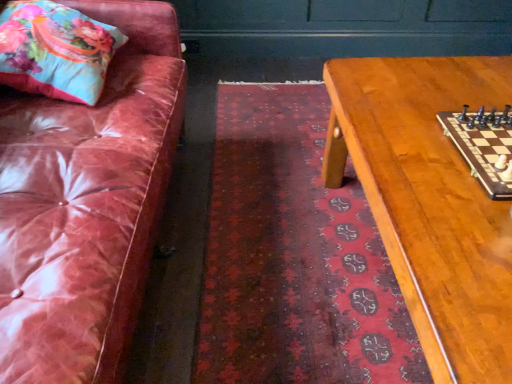
This screenshot has width=512, height=384. What do you see at coordinates (294, 256) in the screenshot?
I see `dark red textured rug at center` at bounding box center [294, 256].

What are the coordinates of `floral fabric pillow at upper left` in the screenshot? It's located at (55, 51).

Where is `wooden chessboard at right`? Image resolution: width=512 pixels, height=384 pixels. wooden chessboard at right is located at coordinates (484, 146).

Identify the location of dark red textured rug at center. (294, 256).

Considering the sizes of wooden chessboard at right and floral fabric pillow at upper left in the image, is wooden chessboard at right taller or shorter than floral fabric pillow at upper left?

Considering their sizes, wooden chessboard at right has less height than floral fabric pillow at upper left.

Can you see wooden chessboard at right touching floral fabric pillow at upper left?

No, wooden chessboard at right is not next to floral fabric pillow at upper left.

Where is `board game below the floral fabric pillow at upper left (from the image's perspective)`? board game below the floral fabric pillow at upper left (from the image's perspective) is located at coordinates (484, 146).

Would you say wooden chessboard at right is outside floral fabric pillow at upper left?

That's correct, wooden chessboard at right is outside of floral fabric pillow at upper left.

Considering the sizes of wooden chessboard at right and dark red textured rug at center in the image, is wooden chessboard at right taller or shorter than dark red textured rug at center?

Clearly, wooden chessboard at right is shorter compared to dark red textured rug at center.

I want to click on mat located underneath the wooden chessboard at right (from a real-world perspective), so click(x=294, y=256).

Are wooden chessboard at right and dark red textured rug at center far apart?

They are positioned close to each other.

From a real-world perspective, relative to dark red textured rug at center, is wooden chessboard at right vertically above or below?

In terms of real-world spatial position, wooden chessboard at right is above dark red textured rug at center.

Based on the photo, between wooden chessboard at center and dark red textured rug at center, which one has more height?

wooden chessboard at center is taller.

Is wooden chessboard at center wider or thinner than dark red textured rug at center?

Considering their sizes, wooden chessboard at center looks broader than dark red textured rug at center.

Looking at the image, does wooden chessboard at center seem bigger or smaller compared to dark red textured rug at center?

In the image, wooden chessboard at center appears to be larger than dark red textured rug at center.

From the picture: Is the position of wooden chessboard at center less distant than that of dark red textured rug at center?

Yes, it is.

Is dark red textured rug at center positioned beyond the bounds of floral fabric pillow at upper left?

That's correct, dark red textured rug at center is outside of floral fabric pillow at upper left.

From the image's perspective, is dark red textured rug at center located above or below floral fabric pillow at upper left?

Based on their image positions, dark red textured rug at center is located beneath floral fabric pillow at upper left.

Considering the relative sizes of dark red textured rug at center and floral fabric pillow at upper left in the image provided, is dark red textured rug at center shorter than floral fabric pillow at upper left?

Indeed, dark red textured rug at center has a lesser height compared to floral fabric pillow at upper left.

How many degrees apart are the facing directions of dark red textured rug at center and floral fabric pillow at upper left?

The angle between the facing direction of dark red textured rug at center and the facing direction of floral fabric pillow at upper left is 0.296 degrees.

Locate an element on the screen. The height and width of the screenshot is (384, 512). throw pillow that appears above the dark red textured rug at center (from a real-world perspective) is located at coordinates (55, 51).

Which is in front, floral fabric pillow at upper left or dark red textured rug at center?

dark red textured rug at center is more forward.

Does point (55, 41) come closer to viewer compared to point (208, 379)?

No, (55, 41) is behind (208, 379).

Which is in front, point (331, 376) or point (488, 134)?

The point (488, 134) is more forward.

From the image's perspective, which one is positioned lower, dark red textured rug at center or wooden chessboard at right?

dark red textured rug at center appears lower in the image.

Are dark red textured rug at center and wooden chessboard at right making contact?

No, dark red textured rug at center is not touching wooden chessboard at right.

From a real-world perspective, which is physically below, dark red textured rug at center or wooden chessboard at right?

dark red textured rug at center.

The height and width of the screenshot is (384, 512). Find the location of `throw pillow positioned vertically above the wooden chessboard at right (from a real-world perspective)`. throw pillow positioned vertically above the wooden chessboard at right (from a real-world perspective) is located at coordinates click(55, 51).

Considering the relative sizes of floral fabric pillow at upper left and wooden chessboard at right in the image provided, is floral fabric pillow at upper left smaller than wooden chessboard at right?

Incorrect, floral fabric pillow at upper left is not smaller in size than wooden chessboard at right.

From the image's perspective, relative to wooden chessboard at right, is floral fabric pillow at upper left above or below?

Clearly, from the image's perspective, floral fabric pillow at upper left is above wooden chessboard at right.

How many degrees apart are the facing directions of floral fabric pillow at upper left and wooden chessboard at right?

There is a 0.000992-degree angle between the facing directions of floral fabric pillow at upper left and wooden chessboard at right.

Where is `throw pillow that appears on the left of wooden chessboard at right`? throw pillow that appears on the left of wooden chessboard at right is located at coordinates (55, 51).

Identify the location of board game in front of the dark red textured rug at center. The width and height of the screenshot is (512, 384). (484, 146).

Considering their positions, is floral fabric pillow at upper left positioned closer to wooden chessboard at center than dark red textured rug at center?

The object closer to wooden chessboard at center is dark red textured rug at center.

Which object lies further to the anchor point wooden chessboard at right, floral fabric pillow at upper left or wooden chessboard at center?

floral fabric pillow at upper left.

Estimate the real-world distances between objects in this image. Which object is closer to floral fabric pillow at upper left, wooden chessboard at center or wooden chessboard at right?

wooden chessboard at center is closer to floral fabric pillow at upper left.

Considering their positions, is wooden chessboard at right positioned further to wooden chessboard at center than dark red textured rug at center?

dark red textured rug at center.

From the image, which object appears to be farther from wooden chessboard at center, dark red textured rug at center or wooden chessboard at right?

Among the two, dark red textured rug at center is located further to wooden chessboard at center.

Looking at the image, which one is located closer to wooden chessboard at right, wooden chessboard at center or dark red textured rug at center?

Based on the image, wooden chessboard at center appears to be nearer to wooden chessboard at right.

From the picture: Based on their spatial positions, is dark red textured rug at center or wooden chessboard at center closer to wooden chessboard at right?

wooden chessboard at center.

Based on their spatial positions, is wooden chessboard at center or dark red textured rug at center further from floral fabric pillow at upper left?

wooden chessboard at center.

Where is `mat between floral fabric pillow at upper left and wooden chessboard at right in the horizontal direction`? mat between floral fabric pillow at upper left and wooden chessboard at right in the horizontal direction is located at coordinates (294, 256).

Image resolution: width=512 pixels, height=384 pixels. I want to click on table situated between dark red textured rug at center and wooden chessboard at right from left to right, so click(430, 201).

Find the location of a particular element. The width and height of the screenshot is (512, 384). mat between floral fabric pillow at upper left and wooden chessboard at center in the horizontal direction is located at coordinates (294, 256).

This screenshot has height=384, width=512. In order to click on table between floral fabric pillow at upper left and wooden chessboard at right in this screenshot , I will do `click(430, 201)`.